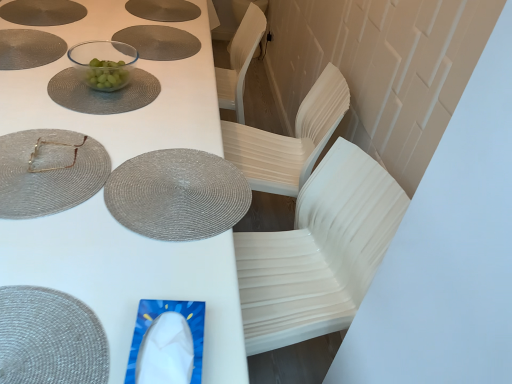
Find the location of a particular element. Image resolution: width=512 pixels, height=384 pixels. free point above matte gray placemat at upper left, the second plate positioned from the right (from a real-world perspective) is located at coordinates (33, 41).